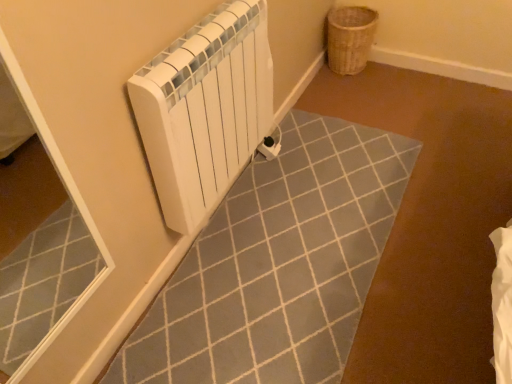
Find the location of `woven brown basket at upper right`. woven brown basket at upper right is located at coordinates (349, 38).

Describe the element at coordinates (349, 38) in the screenshot. The image size is (512, 384). I see `woven brown basket at upper right` at that location.

What is the approximate width of white matte radiator at upper left?

It is 14.13 centimeters.

You are a GUI agent. You are given a task and a screenshot of the screen. Output one action in this format:
    pyautogui.click(x=<x>, y=<y>)
    Task: Click on the white matte radiator at upper left
    The height and width of the screenshot is (384, 512).
    Given the screenshot: What is the action you would take?
    pyautogui.click(x=205, y=109)

Describe the element at coordinates (205, 109) in the screenshot. I see `white matte radiator at upper left` at that location.

In order to click on woven brown basket at upper right in this screenshot , I will do `click(349, 38)`.

Between woven brown basket at upper right and white matte radiator at upper left, which one appears on the left side from the viewer's perspective?

white matte radiator at upper left is more to the left.

Between woven brown basket at upper right and white matte radiator at upper left, which one is positioned in front?

white matte radiator at upper left is more forward.

Is point (334, 54) closer or farther from the camera than point (180, 160)?

Point (334, 54) appears to be farther away from the viewer than point (180, 160).

From the image's perspective, is woven brown basket at upper right located above or below white matte radiator at upper left?

woven brown basket at upper right is above white matte radiator at upper left.

From a real-world perspective, is woven brown basket at upper right under white matte radiator at upper left?

Indeed, from a real-world perspective, woven brown basket at upper right is positioned beneath white matte radiator at upper left.

Does woven brown basket at upper right have a greater width compared to white matte radiator at upper left?

Indeed, woven brown basket at upper right has a greater width compared to white matte radiator at upper left.

Which of these two, woven brown basket at upper right or white matte radiator at upper left, stands shorter?

woven brown basket at upper right is shorter.

Considering the relative sizes of woven brown basket at upper right and white matte radiator at upper left in the image provided, is woven brown basket at upper right smaller than white matte radiator at upper left?

Yes.

Is white matte radiator at upper left a part of woven brown basket at upper right?

Definitely not — white matte radiator at upper left is not inside woven brown basket at upper right.

Is woven brown basket at upper right not near white matte radiator at upper left?

That's right, there is a large distance between woven brown basket at upper right and white matte radiator at upper left.

Is woven brown basket at upper right oriented away from white matte radiator at upper left?

No.

Can you tell me how much woven brown basket at upper right and white matte radiator at upper left differ in facing direction?

0.000676 degrees separate the facing orientations of woven brown basket at upper right and white matte radiator at upper left.

How distant is woven brown basket at upper right from white matte radiator at upper left?

woven brown basket at upper right and white matte radiator at upper left are 1.17 meters apart.

Identify the location of basket that appears on the right of white matte radiator at upper left. This screenshot has width=512, height=384. (349, 38).

Between white matte radiator at upper left and woven brown basket at upper right, which one appears on the right side from the viewer's perspective?

Positioned to the right is woven brown basket at upper right.

Considering the positions of objects white matte radiator at upper left and woven brown basket at upper right in the image provided, who is in front, white matte radiator at upper left or woven brown basket at upper right?

white matte radiator at upper left is more forward.

Is point (221, 145) closer or farther from the camera than point (344, 67)?

Point (221, 145) is positioned closer to the camera compared to point (344, 67).

From the image's perspective, does white matte radiator at upper left appear lower than woven brown basket at upper right?

Correct, white matte radiator at upper left appears lower than woven brown basket at upper right in the image.

From a real-world perspective, is white matte radiator at upper left below woven brown basket at upper right?

No.

Can you confirm if white matte radiator at upper left is thinner than woven brown basket at upper right?

Indeed, white matte radiator at upper left has a lesser width compared to woven brown basket at upper right.

Considering the sizes of white matte radiator at upper left and woven brown basket at upper right in the image, is white matte radiator at upper left taller or shorter than woven brown basket at upper right?

In the image, white matte radiator at upper left appears to be taller than woven brown basket at upper right.

Considering the sizes of objects white matte radiator at upper left and woven brown basket at upper right in the image provided, who is smaller, white matte radiator at upper left or woven brown basket at upper right?

With smaller size is woven brown basket at upper right.

Is white matte radiator at upper left inside the boundaries of woven brown basket at upper right, or outside?

white matte radiator at upper left is outside woven brown basket at upper right.

Is white matte radiator at upper left not close to woven brown basket at upper right?

Yes, white matte radiator at upper left is far from woven brown basket at upper right.

Is white matte radiator at upper left looking in the opposite direction of woven brown basket at upper right?

No, white matte radiator at upper left is not facing away from woven brown basket at upper right.

This screenshot has width=512, height=384. In order to click on bath heater that is above the woven brown basket at upper right (from a real-world perspective) in this screenshot , I will do 205,109.

This screenshot has height=384, width=512. I want to click on basket behind the white matte radiator at upper left, so click(x=349, y=38).

Locate an element on the screen. The height and width of the screenshot is (384, 512). bath heater below the woven brown basket at upper right (from the image's perspective) is located at coordinates point(205,109).